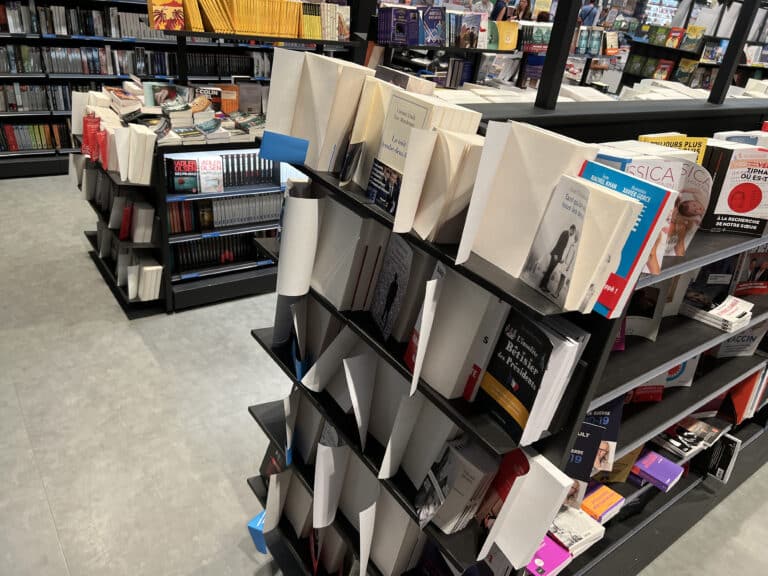
The height and width of the screenshot is (576, 768). I want to click on shadow on floor, so click(169, 339).